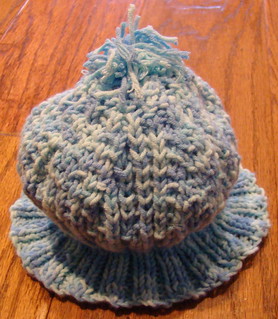
Identify the location of line in floor. This screenshot has width=278, height=319. (16, 19), (11, 133), (50, 304).